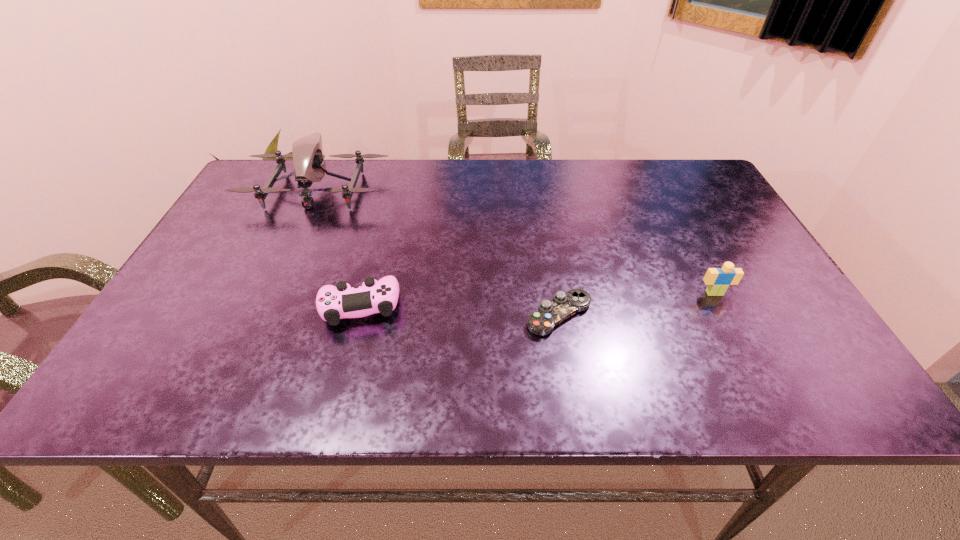
The height and width of the screenshot is (540, 960). Identify the location of vacant space located 0.090m on the right of the second shortest object. (443, 306).

Identify the location of vacant space located 0.270m on the right of the right control. (720, 315).

You are a GUI agent. You are given a task and a screenshot of the screen. Output one action in this format:
    pyautogui.click(x=<x>, y=<y>)
    Task: Click on the object that is at the far edge
    The width and height of the screenshot is (960, 540).
    Given the screenshot: What is the action you would take?
    pyautogui.click(x=307, y=155)

In order to click on object that is at the left edge in this screenshot , I will do `click(307, 155)`.

Find the location of a particular element. This screenshot has height=540, width=960. object located at the right edge is located at coordinates (718, 280).

Image resolution: width=960 pixels, height=540 pixels. In order to click on object that is at the far left corner in this screenshot , I will do click(x=307, y=155).

Find the location of a particular element. blank area at the far edge is located at coordinates (601, 195).

In the image, there is a desktop. Find the location of `blank space at the near edge`. blank space at the near edge is located at coordinates (348, 395).

In the image, there is a desktop. Where is `vacant space at the left edge`? vacant space at the left edge is located at coordinates (217, 242).

The width and height of the screenshot is (960, 540). In the image, there is a desktop. Find the location of `vacant space at the right edge`. vacant space at the right edge is located at coordinates (731, 258).